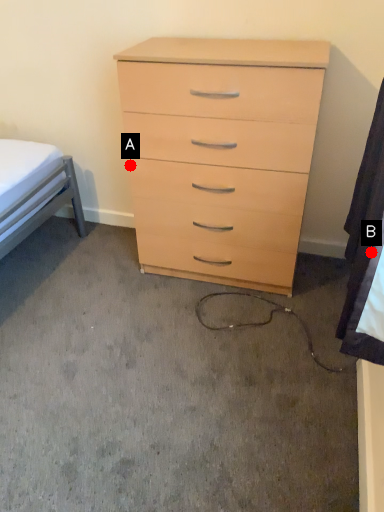
Question: Two points are circled on the image, labeled by A and B beside each circle. Which point appears farthest from the camera in this image?

Choices:
 (A) A is further
 (B) B is further

Answer: (A)